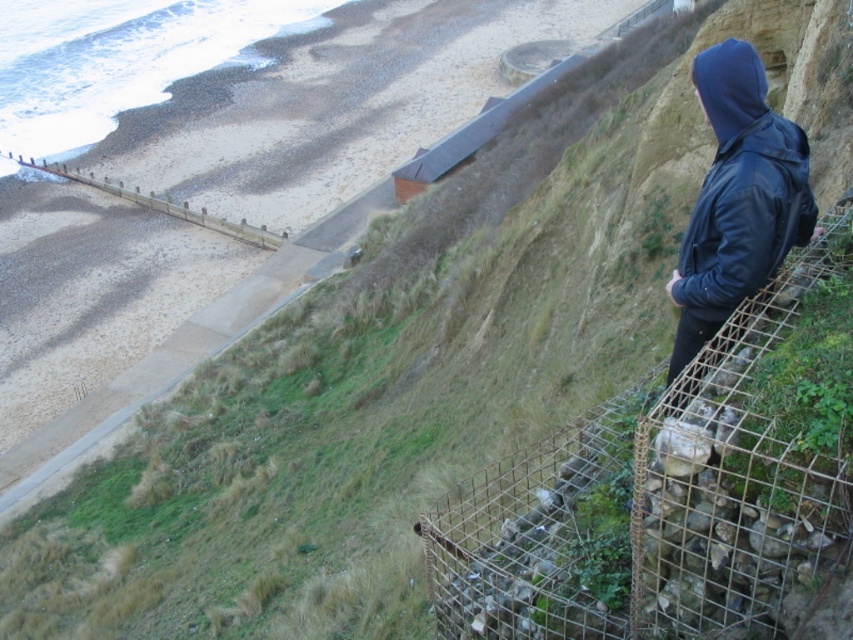
Between metal wire mesh at right and black leather jacket at right, which one is positioned higher?

black leather jacket at right is higher up.

Which is behind, point (775, 628) or point (778, 154)?

The point (778, 154) is more distant.

Image resolution: width=853 pixels, height=640 pixels. Find the location of `metal wire mesh at right`. metal wire mesh at right is located at coordinates (656, 500).